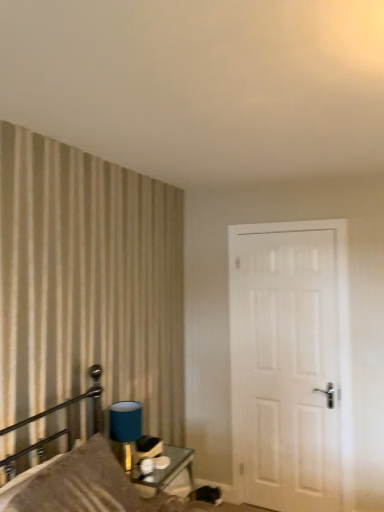
This screenshot has height=512, width=384. I want to click on vacant region above white matte door at right (from a real-world perspective), so click(294, 227).